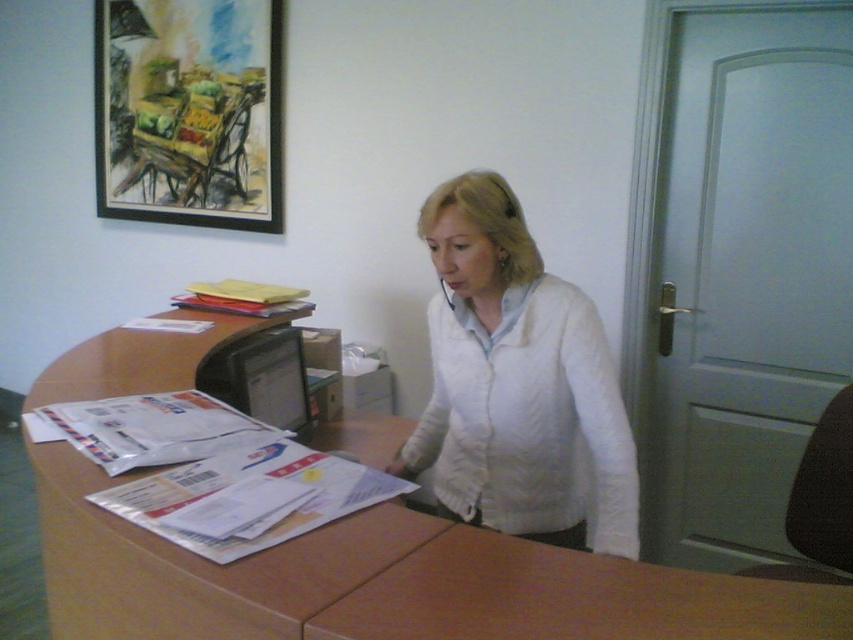
Is brown wood table at center further to the viewer compared to matte black monitor at center?

No, it is not.

Who is lower down, brown wood table at center or matte black monitor at center?

Positioned lower is brown wood table at center.

This screenshot has height=640, width=853. I want to click on brown wood table at center, so click(161, 570).

Where is `brown wood table at center`? Image resolution: width=853 pixels, height=640 pixels. brown wood table at center is located at coordinates (161, 570).

Consider the image. Who is lower down, white matte shirt at center or brown wood table at center?

brown wood table at center

Locate an element on the screen. The width and height of the screenshot is (853, 640). white matte shirt at center is located at coordinates (517, 384).

Does brown wood table at center have a lesser height compared to brown wooden table at center?

No, brown wood table at center is not shorter than brown wooden table at center.

Which is behind, point (392, 440) or point (750, 620)?

The point (392, 440) is behind.

The width and height of the screenshot is (853, 640). Identify the location of brown wood table at center. (161, 570).